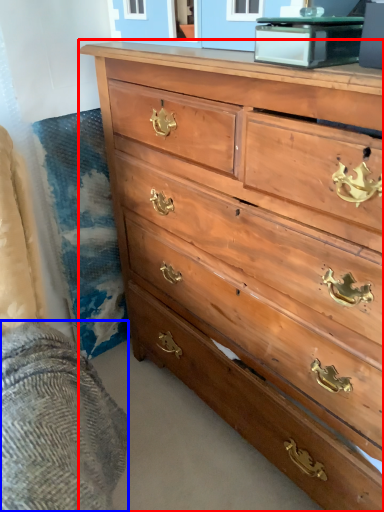
Question: Which object is closer to the camera taking this photo, chest of drawers (highlighted by a red box) or bedding (highlighted by a blue box)?

Choices:
 (A) chest of drawers
 (B) bedding

Answer: (B)